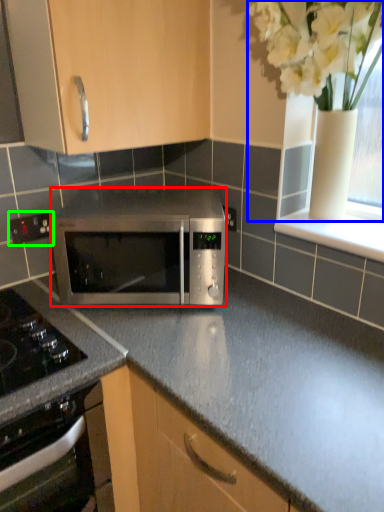
Question: Which object is positioned closest to microwave oven (highlighted by a red box)? Select from floral arrangement (highlighted by a blue box) and electric outlet (highlighted by a green box).

Choices:
 (A) floral arrangement
 (B) electric outlet

Answer: (B)